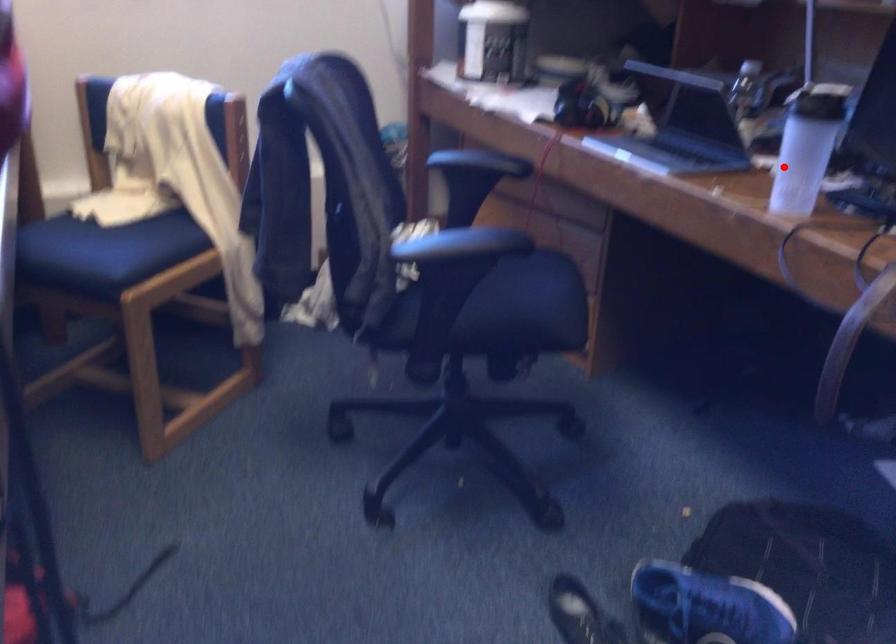
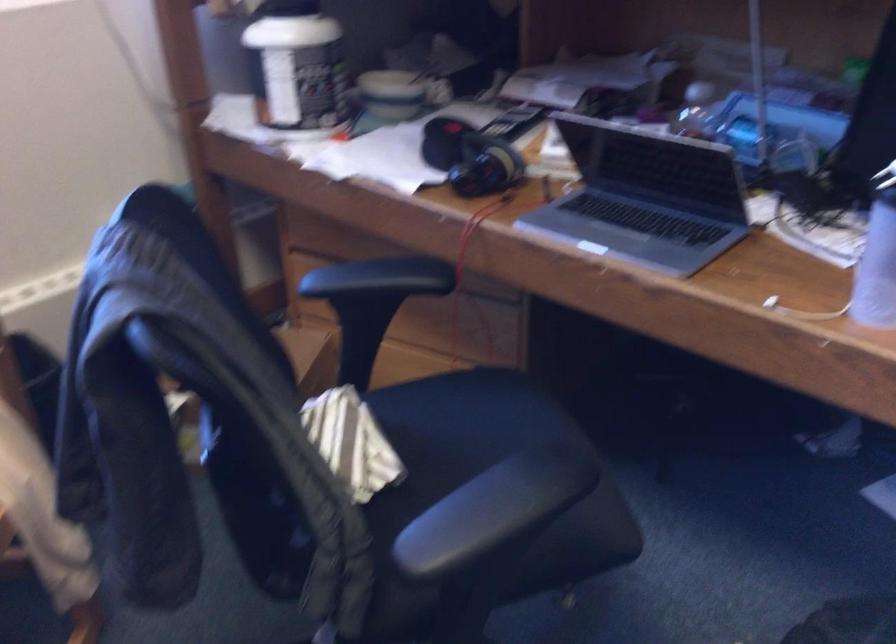
Question: I am providing you with two images of the same scene from different viewpoints. Image1 has a red point marked. In image2, the corresponding 3D location appears at what relative position? Reply with the corresponding letter.

Choices:
 (A) Closer
 (B) Farther

Answer: (A)